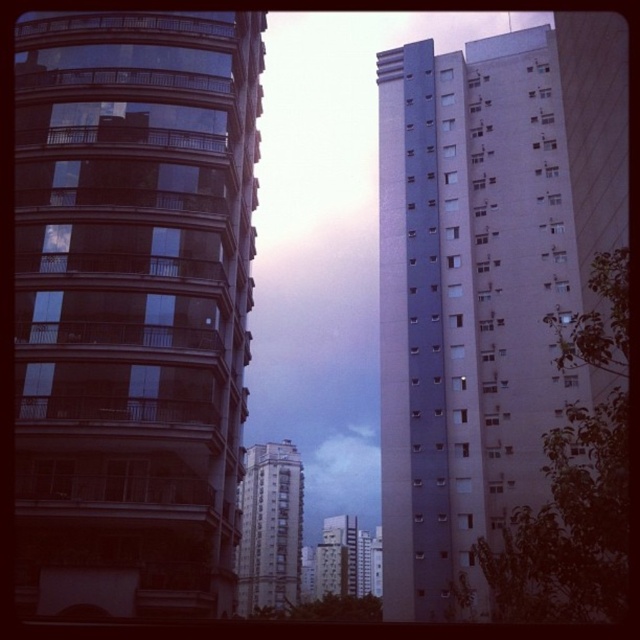
You are standing in the urban scene and want to reach the point marked as point (428,401). Given that your walking speed is 3 feet per second, how many seconds will it take you to reach the point?

The point (428,401) is 248.92 feet away from the viewer. At a walking speed of 3 feet per second, it will take approximately 248.92 divided by 3, which is about 82.97 seconds, so roughly 83 seconds to reach the point.

You are standing in the middle of the street looking at the glassy reflective building at left and the white concrete building at center. Which building would appear larger to you?

The glassy reflective building at left appears larger because it is closer to the viewer than the white concrete building at center.